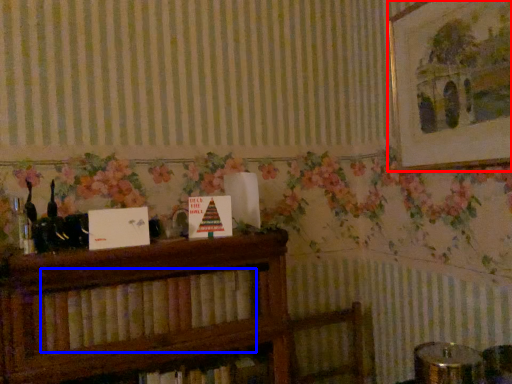
Question: Among these objects, which one is farthest to the camera, picture frame (highlighted by a red box) or book (highlighted by a blue box)?

Choices:
 (A) picture frame
 (B) book

Answer: (A)